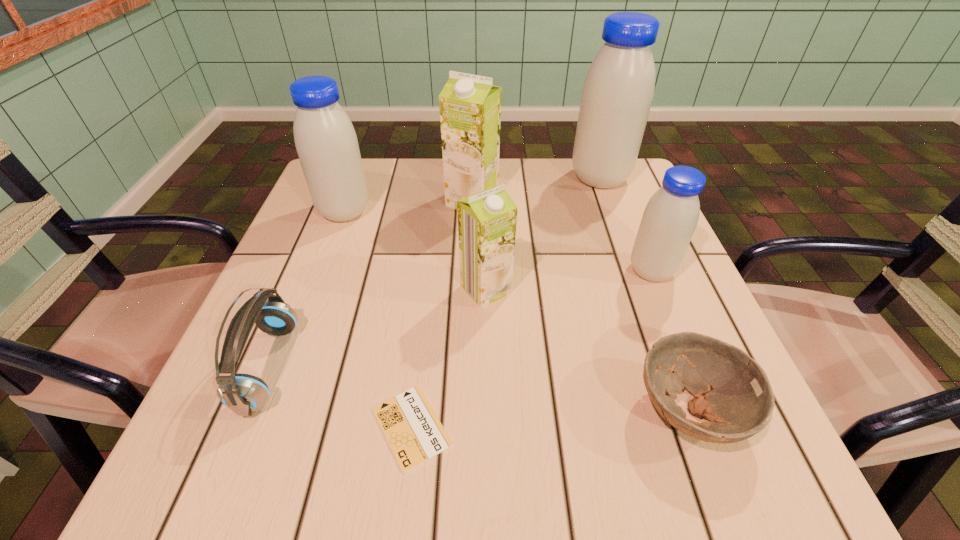
Where is `free location at the left edge of the desktop`? This screenshot has width=960, height=540. free location at the left edge of the desktop is located at coordinates (216, 426).

Find the location of a particular element. Image resolution: width=960 pixels, height=540 pixels. free spot at the right edge of the desktop is located at coordinates (628, 301).

In the image, there is a desktop. Find the location of `vacant space at the far right corner`. vacant space at the far right corner is located at coordinates (637, 205).

Where is `free spot at the near right corner of the desktop`? The height and width of the screenshot is (540, 960). free spot at the near right corner of the desktop is located at coordinates (670, 469).

At what (x,y) coordinates should I click in order to perform the action: click on vacant area that lies between the leftmost soya milk and the identity card. Please return your answer as a coordinate pair (x, y). The height and width of the screenshot is (540, 960). Looking at the image, I should click on (378, 319).

In order to click on free area in between the third shortest object and the smallest blue soya milk in this screenshot , I will do (x=460, y=319).

Identify the location of vacant area between the bigger green soya milk and the leftmost blue soya milk. The width and height of the screenshot is (960, 540). (408, 206).

Locate an element on the screen. The height and width of the screenshot is (540, 960). unoccupied position between the brown bowl and the bigger green soya milk is located at coordinates (581, 306).

Find the location of a particular element. This screenshot has height=540, width=960. free space that is in between the farther green soya milk and the bowl is located at coordinates [x=581, y=306].

Locate an element on the screen. Image resolution: width=960 pixels, height=540 pixels. empty location between the brown bowl and the smaller green soya milk is located at coordinates (588, 349).